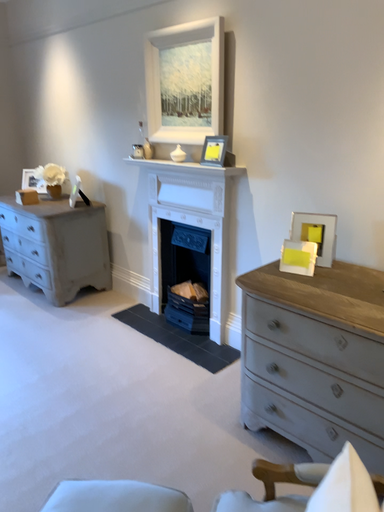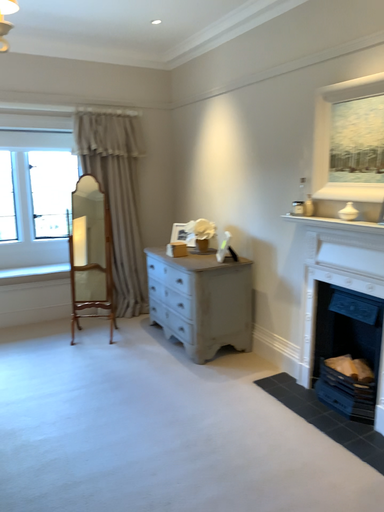
Question: How did the camera likely rotate when shooting the video?

Choices:
 (A) rotated right
 (B) rotated left

Answer: (B)